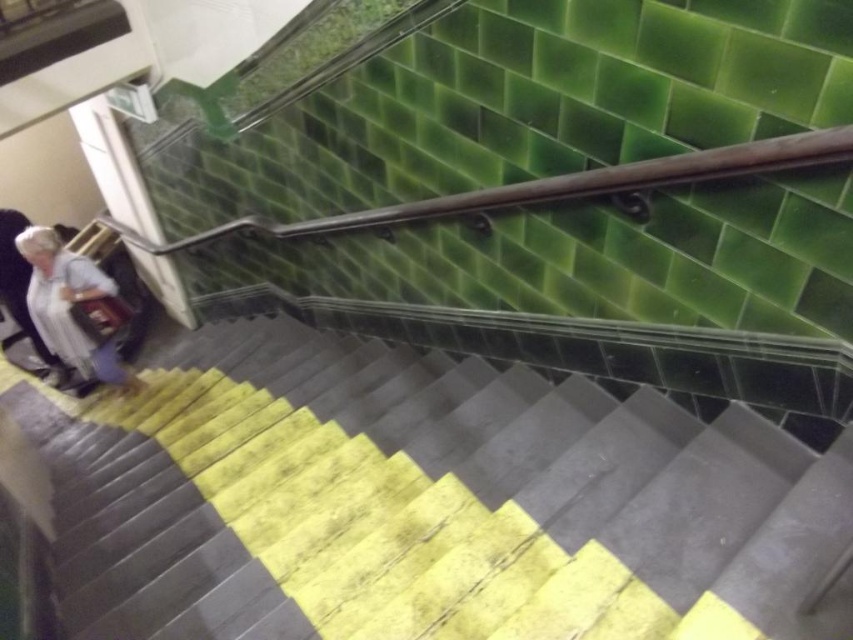
Question: Does yellow rubber steps at lower left have a greater width compared to light gray fabric coat at left?

Choices:
 (A) no
 (B) yes

Answer: (B)

Question: Can you confirm if yellow rubber steps at lower left is positioned above light gray fabric coat at left?

Choices:
 (A) no
 (B) yes

Answer: (A)

Question: Which point is closer to the camera?

Choices:
 (A) yellow rubber steps at lower left
 (B) light gray fabric coat at left

Answer: (A)

Question: Which is farther from the light gray fabric coat at left?

Choices:
 (A) wooden handrail at upper center
 (B) yellow rubber steps at lower left

Answer: (A)

Question: Can you confirm if yellow rubber steps at lower left is smaller than wooden handrail at upper center?

Choices:
 (A) yes
 (B) no

Answer: (B)

Question: Which object appears closest to the camera in this image?

Choices:
 (A) light gray fabric coat at left
 (B) wooden handrail at upper center

Answer: (B)